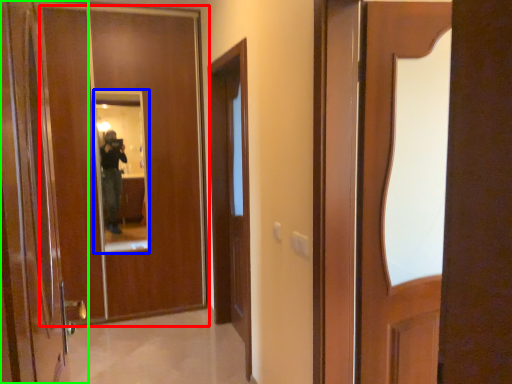
Question: Considering the real-world distances, which object is farthest from door (highlighted by a red box)? mirror (highlighted by a blue box) or door (highlighted by a green box)?

Choices:
 (A) mirror
 (B) door

Answer: (B)